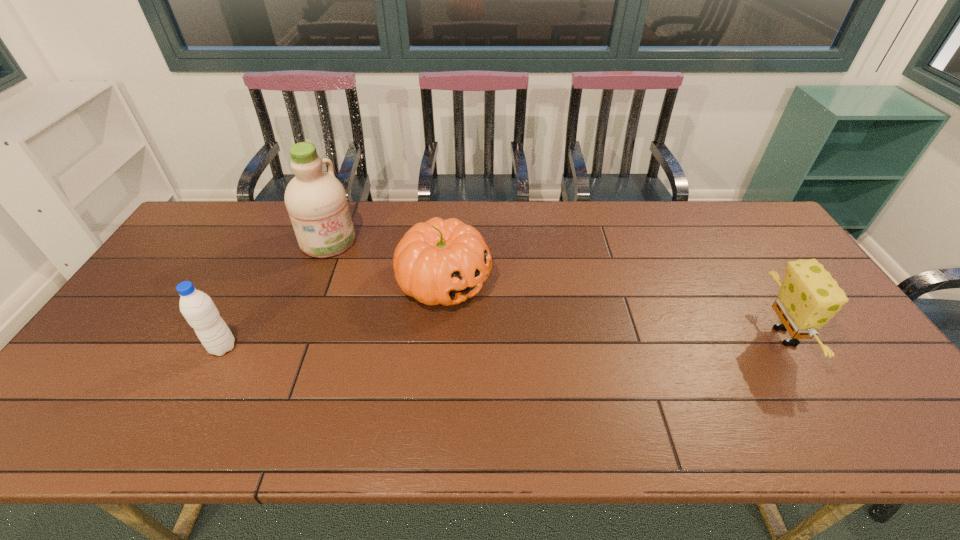
Where is `water bottle`? The image size is (960, 540). water bottle is located at coordinates (198, 309).

At what (x,y) coordinates should I click in order to perform the action: click on the rightmost object. Please return your answer as a coordinate pair (x, y). Looking at the image, I should click on click(808, 297).

Identify the location of the third object from right to left. (316, 201).

Where is `the tallest object`? The image size is (960, 540). the tallest object is located at coordinates pyautogui.click(x=316, y=201).

Where is `pumpkin`? This screenshot has width=960, height=540. pumpkin is located at coordinates (439, 261).

The width and height of the screenshot is (960, 540). What are the coordinates of `blank space located 0.110m on the left of the water bottle` in the screenshot? It's located at (167, 347).

At what (x,y) coordinates should I click in order to perform the action: click on vacant area located on the face of the rightmost object. Please return your answer as a coordinate pair (x, y). The height and width of the screenshot is (540, 960). Looking at the image, I should click on (832, 336).

Find the location of a particular element. The image size is (960, 540). blank space located on the front label of the second object from left to right is located at coordinates (365, 275).

The width and height of the screenshot is (960, 540). I want to click on vacant space situated 0.210m on the front label of the second object from left to right, so click(379, 290).

This screenshot has height=540, width=960. What are the coordinates of `free spot located 0.080m on the front label of the second object from left to right` in the screenshot? It's located at (356, 267).